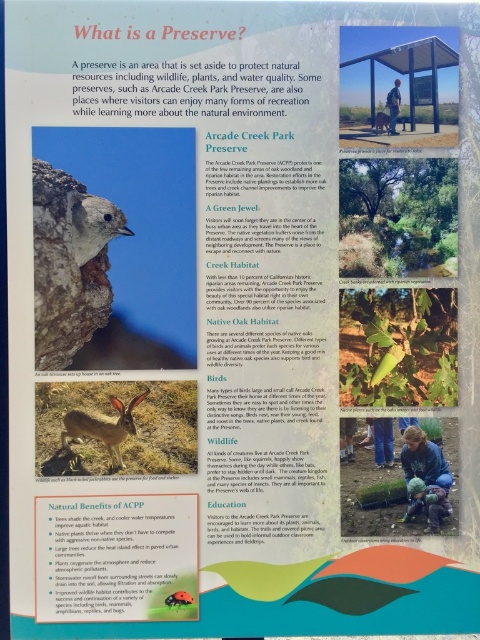
Question: Is gray furry bird at upper left below brown furry rabbit at lower left?

Choices:
 (A) no
 (B) yes

Answer: (A)

Question: Which point is farther from the camera taking this photo?

Choices:
 (A) (379, 129)
 (B) (412, 508)

Answer: (A)

Question: Is gray furry bird at upper left above blue denim jacket at lower right?

Choices:
 (A) no
 (B) yes

Answer: (B)

Question: Which point is farther to the camera?

Choices:
 (A) (168, 602)
 (B) (118, 424)
 (C) (382, 112)
 (D) (415, 488)

Answer: (B)

Question: Does gray furry bird at upper left come behind green leafy plant at lower left?

Choices:
 (A) no
 (B) yes

Answer: (B)

Question: Estimate the real-world distances between objects in this image. Which object is farther from the blue denim jacket at lower right?

Choices:
 (A) green leafy plant at lower left
 (B) gray furry bird at upper left
 (C) brown fur rabbit at center

Answer: (C)